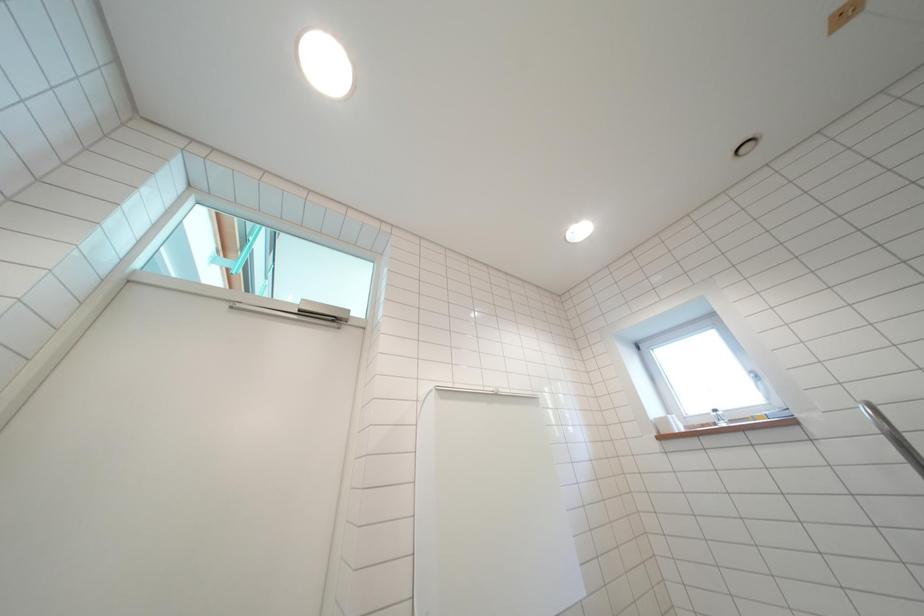
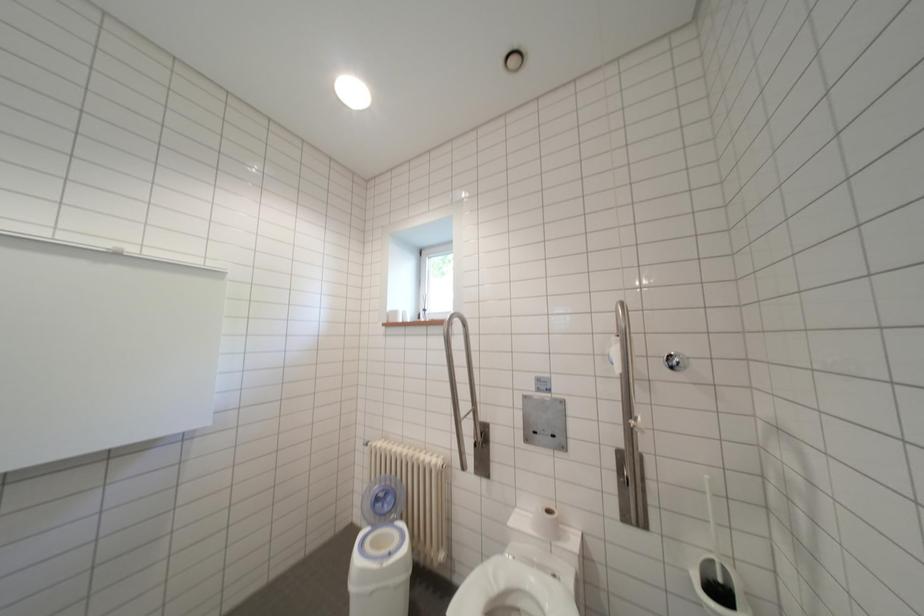
How did the camera likely rotate?

The camera's rotation is toward right-down.